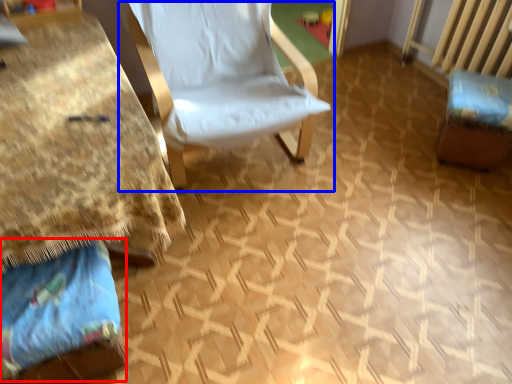
Question: Which object is closer to the camera taking this photo, fabric (highlighted by a red box) or chair (highlighted by a blue box)?

Choices:
 (A) fabric
 (B) chair

Answer: (A)